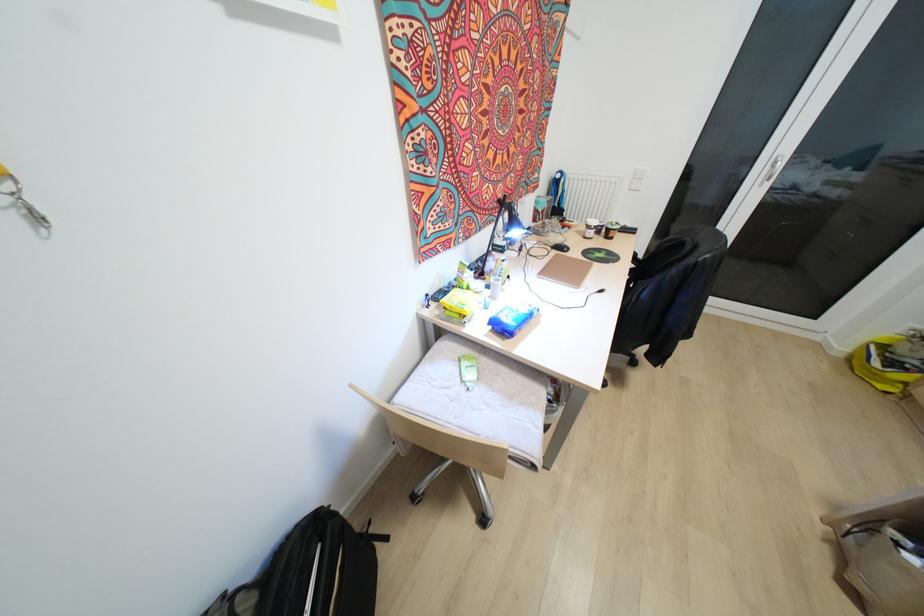
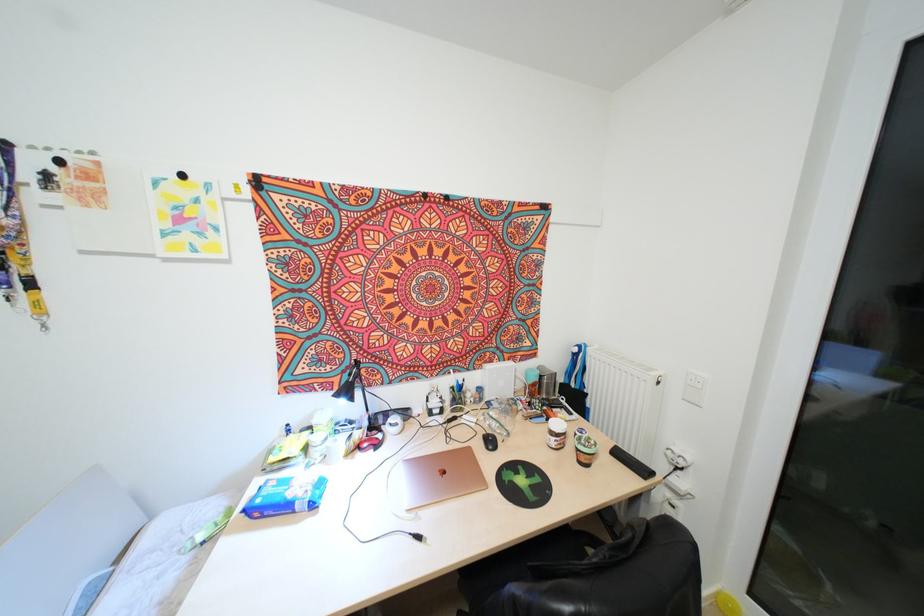
In the second image, find the point that corresponds to pixel 566 249 in the first image.

(494, 448)